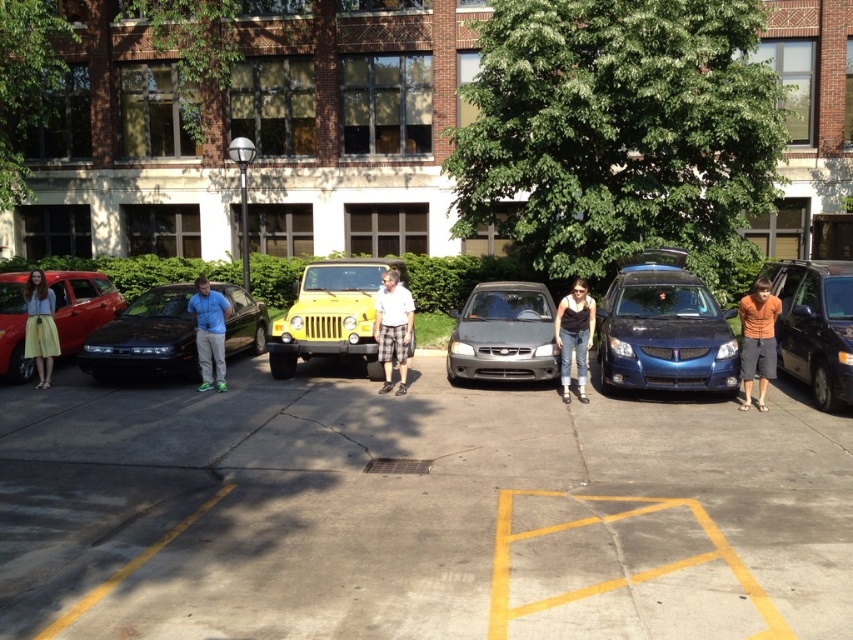
From the picture: Does blue cotton shirt at center appear over yellow skirt at left?

Yes.

Between blue cotton shirt at center and yellow skirt at left, which one has more height?

Standing taller between the two is yellow skirt at left.

Measure the distance between blue cotton shirt at center and camera.

They are 11.55 meters apart.

Locate an element on the screen. This screenshot has width=853, height=640. blue cotton shirt at center is located at coordinates (209, 332).

Is metallic blue station wagon at center closer to the viewer compared to white shirt at center?

Yes, it is in front of white shirt at center.

Is point (654, 269) positioned in front of point (381, 282)?

No.

Is point (641, 257) positioned after point (396, 321)?

Yes, point (641, 257) is farther from viewer.

Where is `metallic blue station wagon at center`? metallic blue station wagon at center is located at coordinates (663, 328).

Can you confirm if yellow matte jeep at center is positioned above yellow skirt at left?

Indeed, yellow matte jeep at center is positioned over yellow skirt at left.

Which of these two, yellow matte jeep at center or yellow skirt at left, stands taller?

Standing taller between the two is yellow matte jeep at center.

Image resolution: width=853 pixels, height=640 pixels. What do you see at coordinates (331, 314) in the screenshot?
I see `yellow matte jeep at center` at bounding box center [331, 314].

This screenshot has width=853, height=640. Identify the location of yellow matte jeep at center. (331, 314).